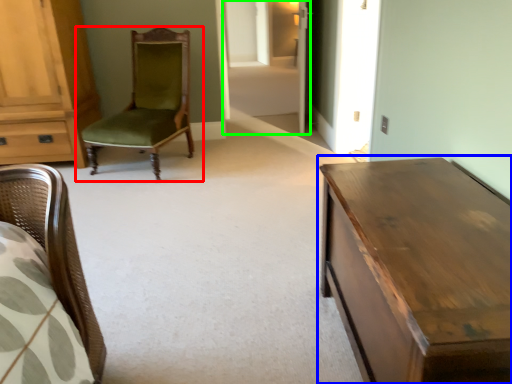
Question: Which is farther away from chair (highlighted by a red box)? table (highlighted by a blue box) or glass door (highlighted by a green box)?

Choices:
 (A) table
 (B) glass door

Answer: (A)